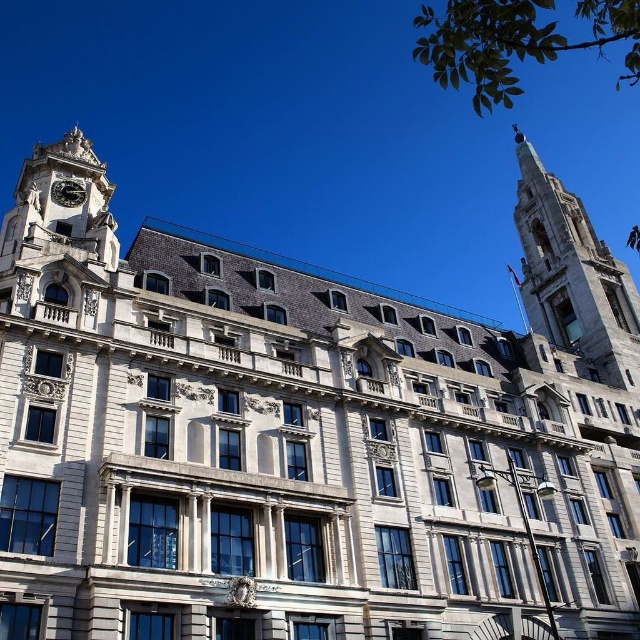
You are a drone operator planning to fly a drone between the polished stone spire at upper right and the polished brass clock at upper left. The drone has a wingspan of 1.2 meters. Can the drone safely navigate the space between them?

The distance between the polished stone spire at upper right and the polished brass clock at upper left is 71.61 meters. Since the drone has a wingspan of 1.2 meters, it can easily navigate the space between them as the distance is significantly larger than the drone.

You are an architect evaluating the symmetry of the building. Based on the image, which object, the polished stone spire at upper right or the polished brass clock at upper left, is wider?

The polished stone spire at upper right might be wider than polished brass clock at upper left according to the description.

You are an architect examining the building and need to determine the placement of a new decorative element. If you want to place a new element to the left of the polished brass clock at upper left, would it be to the left or right of the polished stone spire at upper right?

The polished stone spire at upper right is positioned on the right side of the polished brass clock at upper left, so placing a new element to the left of the polished brass clock at upper left would place it to the left of the polished stone spire at upper right.